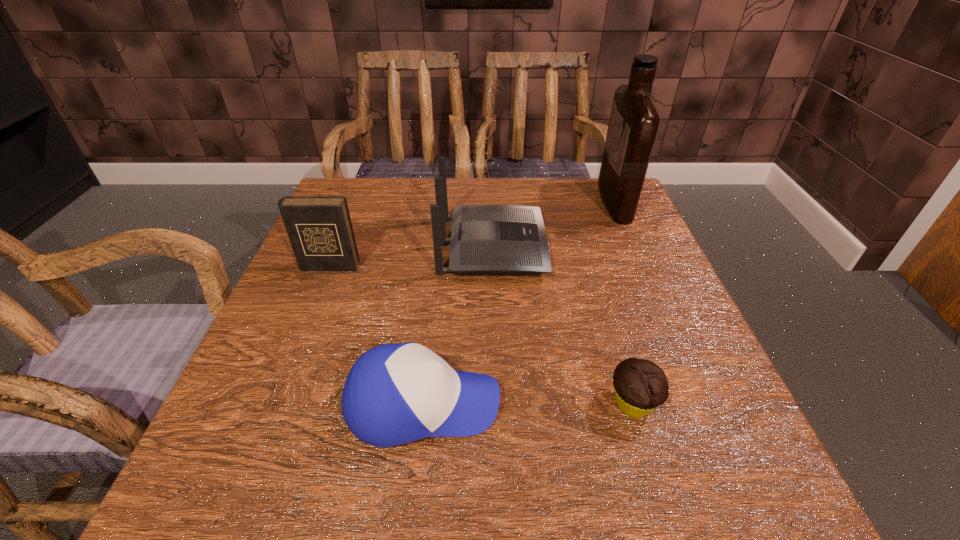
Locate an element on the screen. free space between the router and the fourth tallest object is located at coordinates (458, 326).

In order to click on free spot between the diary and the fourth object from left to right in this screenshot , I will do click(481, 335).

Locate an element on the screen. The width and height of the screenshot is (960, 540). free area in between the tallest object and the baseball cap is located at coordinates (518, 303).

Identify the location of object that is the nearest to the diary. (485, 239).

Identify which object is the nearest to the rightmost object. Please provide its 2D coordinates. Your answer should be formatted as a tuple, i.e. [(x, y)], where the tuple contains the x and y coordinates of a point satisfying the conditions above.

[(485, 239)]

Where is `vacant space that satisfies the following two spatial constraints: 1. on the front cover of the muffin; 2. on the right side of the diary`? vacant space that satisfies the following two spatial constraints: 1. on the front cover of the muffin; 2. on the right side of the diary is located at coordinates (274, 403).

Identify the location of vacant space that satisfies the following two spatial constraints: 1. on the front cover of the fourth object from left to right; 2. on the right side of the diary. (274, 403).

At what (x,y) coordinates should I click in order to perform the action: click on vacant space that satisfies the following two spatial constraints: 1. on the front cover of the muffin; 2. on the left side of the diary. Please return your answer as a coordinate pair (x, y). Looking at the image, I should click on pos(274,403).

The height and width of the screenshot is (540, 960). Find the location of `free space that satisfies the following two spatial constraints: 1. on the front cover of the leftmost object; 2. on the left side of the muffin`. free space that satisfies the following two spatial constraints: 1. on the front cover of the leftmost object; 2. on the left side of the muffin is located at coordinates (274, 403).

Identify the location of vacant space that satisfies the following two spatial constraints: 1. on the front cover of the second object from right to left; 2. on the left side of the diary. The height and width of the screenshot is (540, 960). (274, 403).